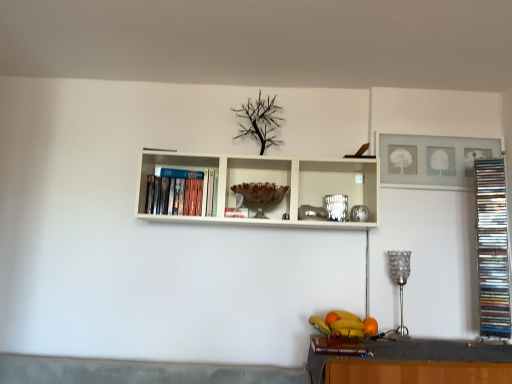
This screenshot has height=384, width=512. Find the location of `matte plastic dvds at left, the 1th book positioned from the back`. matte plastic dvds at left, the 1th book positioned from the back is located at coordinates (181, 192).

At what (x,y) coordinates should I click in order to perform the action: click on metallic silver stack of cds at right, which is the 1th book from right to left. Please return your answer as a coordinate pair (x, y). Looking at the image, I should click on (492, 248).

What is the approximate height of shiny metallic fruit basket at lower center?

7.14 centimeters.

Measure the distance between point (335, 335) and camera.

The depth of point (335, 335) is 1.92 meters.

I want to click on matte plastic dvds at left, placed as the 3th book when sorted from right to left, so click(x=181, y=192).

From the image's perspective, which is below, brown glass bowl at center or orange matte at lower right?

From the image's view, orange matte at lower right is below.

Which is farther from the camera, (261, 218) or (367, 325)?

The point (261, 218) is more distant.

Considering the relative positions of brown glass bowl at center and orange matte at lower right in the image provided, is brown glass bowl at center to the left of orange matte at lower right from the viewer's perspective?

Yes.

What's the angular difference between orange matte at lower right and matte plastic dvds at left, placed as the 3th book when sorted from right to left,'s facing directions?

There is a 0.774-degree angle between the facing directions of orange matte at lower right and matte plastic dvds at left, placed as the 3th book when sorted from right to left.

Considering the relative positions of orange matte at lower right and matte plastic dvds at left, placed as the 3th book when sorted from right to left, in the image provided, is orange matte at lower right to the left or to the right of matte plastic dvds at left, placed as the 3th book when sorted from right to left,?

In the image, orange matte at lower right appears on the right side of matte plastic dvds at left, placed as the 3th book when sorted from right to left.

Can you confirm if orange matte at lower right is thinner than matte plastic dvds at left, the third book when ordered from front to back?

Indeed, orange matte at lower right has a lesser width compared to matte plastic dvds at left, the third book when ordered from front to back.

From a real-world perspective, which is physically above, orange matte at lower right or matte plastic dvds at left, the 1th book positioned from the back?

matte plastic dvds at left, the 1th book positioned from the back.

From the image's perspective, is orange matte at lower right on top of shiny metallic fruit basket at lower center?

Yes, from the image's perspective, orange matte at lower right is on top of shiny metallic fruit basket at lower center.

Would you say orange matte at lower right is to the left or to the right of shiny metallic fruit basket at lower center in the picture?

Clearly, orange matte at lower right is on the right of shiny metallic fruit basket at lower center in the image.

From a real-world perspective, does orange matte at lower right sit lower than shiny metallic fruit basket at lower center?

No.

How different are the orientations of orange matte at lower right and shiny metallic fruit basket at lower center in degrees?

The angle between the facing direction of orange matte at lower right and the facing direction of shiny metallic fruit basket at lower center is 1.66 degrees.

Considering the relative sizes of shiny metallic fruit basket at lower center and metallic silver stack of cds at right, which is the 1th book from right to left, in the image provided, is shiny metallic fruit basket at lower center bigger than metallic silver stack of cds at right, which is the 1th book from right to left,?

No.

The height and width of the screenshot is (384, 512). In order to click on fruit located below the metallic silver stack of cds at right, placed as the third book when sorted from left to right (from the image's perspective) in this screenshot , I will do `click(344, 324)`.

Can metallic silver stack of cds at right, which is the 1th book from right to left, be found inside shiny metallic fruit basket at lower center?

Definitely not — metallic silver stack of cds at right, which is the 1th book from right to left, is not inside shiny metallic fruit basket at lower center.

From the image's perspective, which one is positioned lower, shiny metallic fruit basket at lower center or metallic silver stack of cds at right, arranged as the second book when viewed from the front?

shiny metallic fruit basket at lower center is shown below in the image.

Between metallic silver stack of cds at right, which is the 2th book in back-to-front order, and shiny metallic fruit basket at lower center, which one is positioned behind?

Positioned behind is metallic silver stack of cds at right, which is the 2th book in back-to-front order.

Is point (480, 286) positioned in front of point (330, 328)?

That is False.

Measure the distance between metallic silver stack of cds at right, which is the 2th book in back-to-front order, and shiny metallic fruit basket at lower center.

A distance of 27.44 inches exists between metallic silver stack of cds at right, which is the 2th book in back-to-front order, and shiny metallic fruit basket at lower center.

Identify the location of fruit on the left side of metallic silver stack of cds at right, arranged as the second book when viewed from the front. The image size is (512, 384). (344, 324).

Based on the photo, which of these two, shiny metallic fruit basket at lower center or matte plastic dvds at left, the 1th book positioned from the back, is thinner?

With smaller width is matte plastic dvds at left, the 1th book positioned from the back.

Which of these two, shiny metallic fruit basket at lower center or matte plastic dvds at left, which is the first book in left-to-right order, is smaller?

Smaller between the two is shiny metallic fruit basket at lower center.

From the picture: From the image's perspective, is shiny metallic fruit basket at lower center positioned above or below matte plastic dvds at left, the third book when ordered from front to back?

shiny metallic fruit basket at lower center is situated lower than matte plastic dvds at left, the third book when ordered from front to back, in the image.

Is shiny metallic fruit basket at lower center closer to the viewer compared to matte plastic dvds at left, the 1th book positioned from the back?

Yes, shiny metallic fruit basket at lower center is closer to the camera.

Could you tell me if shiny metallic fruit basket at lower center is facing brown glass bowl at center?

No, shiny metallic fruit basket at lower center is not aimed at brown glass bowl at center.

Is shiny metallic fruit basket at lower center surrounding brown glass bowl at center?

No, brown glass bowl at center is located outside of shiny metallic fruit basket at lower center.

Between shiny metallic fruit basket at lower center and brown glass bowl at center, which one is positioned behind?

brown glass bowl at center is further away from the camera.

In terms of height, does shiny metallic fruit basket at lower center look taller or shorter compared to brown glass bowl at center?

shiny metallic fruit basket at lower center is shorter than brown glass bowl at center.

There is a orange matte at lower right. At what (x,y) coordinates should I click in order to perform the action: click on wine glass above it (from a real-world perspective). Please return your answer as a coordinate pair (x, y). This screenshot has width=512, height=384. Looking at the image, I should click on (260, 196).

Find the location of a particular element. The width and height of the screenshot is (512, 384). book that is the 2nd object to the left of the orange matte at lower right, starting at the anchor is located at coordinates (181, 192).

Based on their spatial positions, is matte plastic dvds at left, the 1th book positioned from the back, or metallic silver stack of cds at right, placed as the third book when sorted from left to right, closer to brown glass bowl at center?

Based on the image, matte plastic dvds at left, the 1th book positioned from the back, appears to be nearer to brown glass bowl at center.

When comparing their distances from shiny metallic fruit basket at lower center, does matte brown book at lower center, the third book when ordered from back to front, or metallic silver stack of cds at right, which is the 2th book in back-to-front order, seem further?

Among the two, metallic silver stack of cds at right, which is the 2th book in back-to-front order, is located further to shiny metallic fruit basket at lower center.

From the image, which object appears to be nearer to shiny metallic fruit basket at lower center, orange matte at lower right or matte plastic dvds at left, which is the first book in left-to-right order?

The object closer to shiny metallic fruit basket at lower center is orange matte at lower right.

Estimate the real-world distances between objects in this image. Which object is further from brown glass bowl at center, orange matte at lower right or shiny metallic fruit basket at lower center?

orange matte at lower right.

From the picture: Based on their spatial positions, is matte brown book at lower center, positioned as the 1th book in front-to-back order, or orange matte at lower right closer to shiny metallic fruit basket at lower center?

Among the two, matte brown book at lower center, positioned as the 1th book in front-to-back order, is located nearer to shiny metallic fruit basket at lower center.

Which object lies further to the anchor point matte brown book at lower center, arranged as the 2th book when viewed from the left, shiny metallic fruit basket at lower center or brown glass bowl at center?

Based on the image, brown glass bowl at center appears to be further to matte brown book at lower center, arranged as the 2th book when viewed from the left.

Estimate the real-world distances between objects in this image. Which object is closer to matte plastic dvds at left, the 1th book positioned from the back, metallic silver stack of cds at right, placed as the third book when sorted from left to right, or shiny metallic fruit basket at lower center?

Among the two, shiny metallic fruit basket at lower center is located nearer to matte plastic dvds at left, the 1th book positioned from the back.

Estimate the real-world distances between objects in this image. Which object is further from orange matte at lower right, matte brown book at lower center, the third book when ordered from back to front, or metallic silver stack of cds at right, arranged as the second book when viewed from the front?

metallic silver stack of cds at right, arranged as the second book when viewed from the front, is positioned further to the anchor orange matte at lower right.

The width and height of the screenshot is (512, 384). I want to click on book between brown glass bowl at center and metallic silver stack of cds at right, arranged as the second book when viewed from the front, in the horizontal direction, so click(x=336, y=345).

At what (x,y) coordinates should I click in order to perform the action: click on fruit between brown glass bowl at center and matte brown book at lower center, the third book when ordered from back to front, from top to bottom. Please return your answer as a coordinate pair (x, y). Looking at the image, I should click on (344, 324).

Image resolution: width=512 pixels, height=384 pixels. Identify the location of orange between brown glass bowl at center and matte brown book at lower center, arranged as the 2th book when viewed from the left, vertically. (370, 326).

At what (x,y) coordinates should I click in order to perform the action: click on fruit between brown glass bowl at center and metallic silver stack of cds at right, which is the 2th book in back-to-front order, in the horizontal direction. Please return your answer as a coordinate pair (x, y). The image size is (512, 384). Looking at the image, I should click on (344, 324).